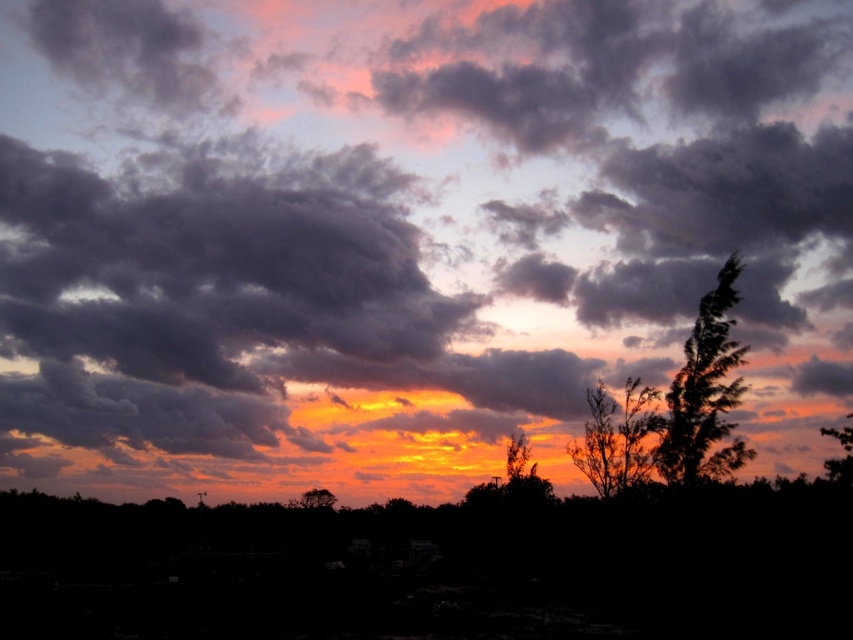
Is silhouette leafy tree at upper right shorter than silhouette leafy tree at center?

In fact, silhouette leafy tree at upper right may be taller than silhouette leafy tree at center.

Who is taller, silhouette leafy tree at upper right or silhouette leafy tree at center?

silhouette leafy tree at upper right

Which is in front, point (706, 372) or point (582, 465)?

Positioned in front is point (706, 372).

Where is `silhouette leafy tree at upper right`? silhouette leafy tree at upper right is located at coordinates (705, 392).

Who is positioned more to the right, silky green leafy tree at right or silky brown tree at center?

silky green leafy tree at right is more to the right.

Does silky green leafy tree at right appear under silky brown tree at center?

Actually, silky green leafy tree at right is above silky brown tree at center.

What do you see at coordinates (840, 458) in the screenshot? Image resolution: width=853 pixels, height=640 pixels. I see `silky green leafy tree at right` at bounding box center [840, 458].

Where is `silky green leafy tree at right`? Image resolution: width=853 pixels, height=640 pixels. silky green leafy tree at right is located at coordinates (840, 458).

Between silhouette leafy tree at upper right and silky green leafy tree at right, which one is positioned higher?

silhouette leafy tree at upper right is higher up.

Is silhouette leafy tree at upper right bigger than silky green leafy tree at right?

Actually, silhouette leafy tree at upper right might be smaller than silky green leafy tree at right.

What do you see at coordinates (705, 392) in the screenshot? I see `silhouette leafy tree at upper right` at bounding box center [705, 392].

Locate an element on the screen. silhouette leafy tree at upper right is located at coordinates (705, 392).